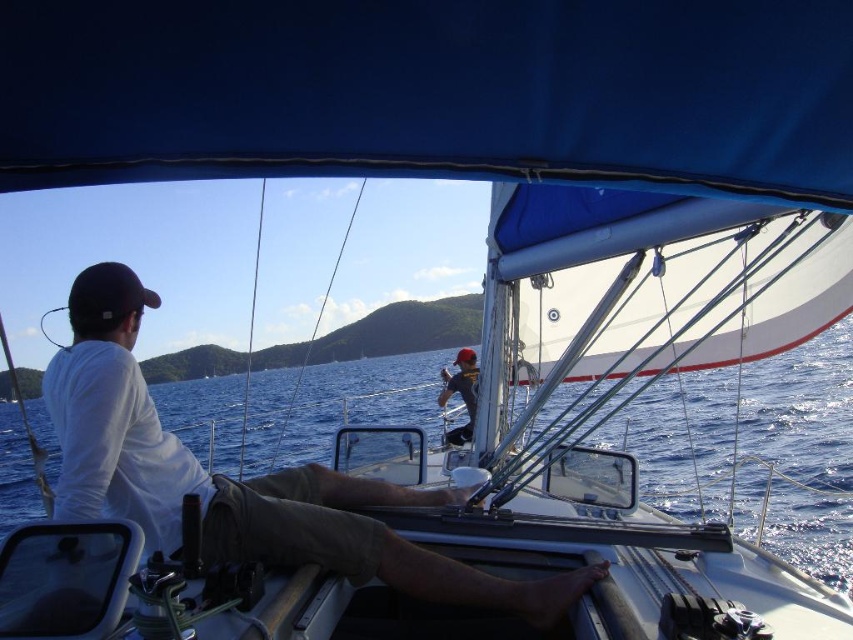
Based on the photo, is the position of blue water at center more distant than that of dark gray fabric cap at upper center?

No, blue water at center is in front of dark gray fabric cap at upper center.

Does point (830, 499) come farther from viewer compared to point (467, 408)?

Yes.

Who is more distant from viewer, (21, 476) or (463, 355)?

Positioned behind is point (21, 476).

In order to click on blue water at center in this screenshot , I will do `click(756, 449)`.